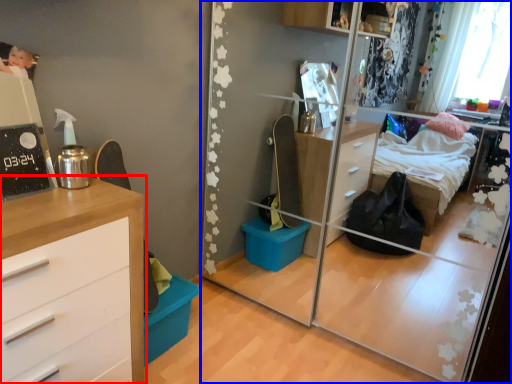
Question: Which point is closer to the camera, chest of drawers (highlighted by a red box) or mirror (highlighted by a blue box)?

Choices:
 (A) chest of drawers
 (B) mirror

Answer: (A)